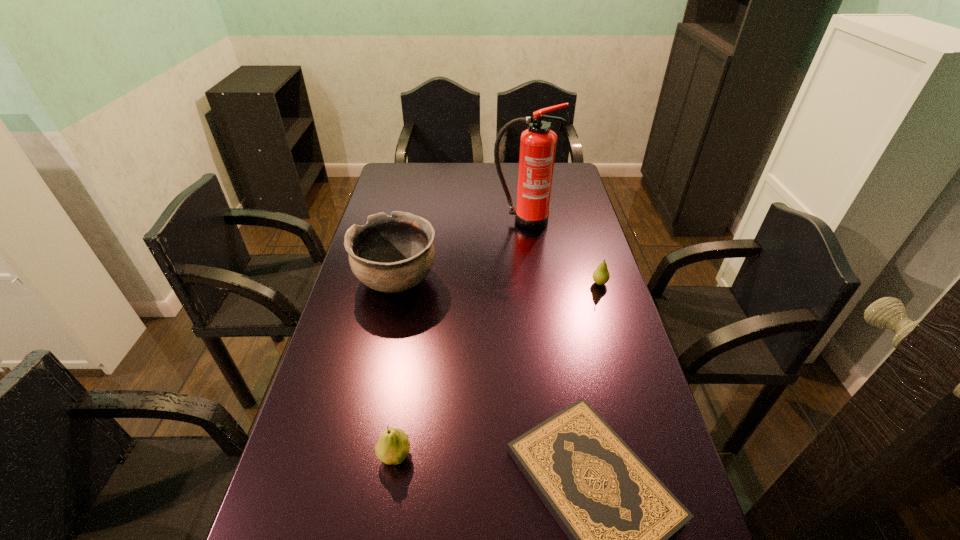
This screenshot has height=540, width=960. In order to click on the farthest object in this screenshot , I will do `click(537, 143)`.

Locate an element on the screen. Image resolution: width=960 pixels, height=540 pixels. the tallest object is located at coordinates (537, 143).

Find the location of a particular element. The width and height of the screenshot is (960, 540). the fourth shortest object is located at coordinates (390, 254).

In order to click on the nearer pear in this screenshot , I will do `click(393, 445)`.

Locate an element on the screen. Image resolution: width=960 pixels, height=540 pixels. the right pear is located at coordinates (601, 275).

You are a GUI agent. You are given a task and a screenshot of the screen. Output one action in this format:
    pyautogui.click(x=<x>, y=<y>)
    Task: Click on the free region located 0.280m at the nozzle of the tallest object
    
    Given the screenshot: What is the action you would take?
    pyautogui.click(x=531, y=281)

At what (x,y) coordinates should I click in order to perform the action: click on vacant region located 0.050m on the right of the fourth shortest object. Please return your answer as a coordinate pair (x, y). Looking at the image, I should click on (454, 280).

The height and width of the screenshot is (540, 960). What are the coordinates of `vacant space located 0.150m on the right of the nearer pear` in the screenshot? It's located at (480, 456).

The height and width of the screenshot is (540, 960). Identify the location of vacant space situated on the back of the farther pear. (588, 246).

You are a GUI agent. You are given a task and a screenshot of the screen. Output one action in this format:
    pyautogui.click(x=<x>, y=<y>)
    Task: Click on the object at the left edge
    The width and height of the screenshot is (960, 540).
    Given the screenshot: What is the action you would take?
    pyautogui.click(x=390, y=254)